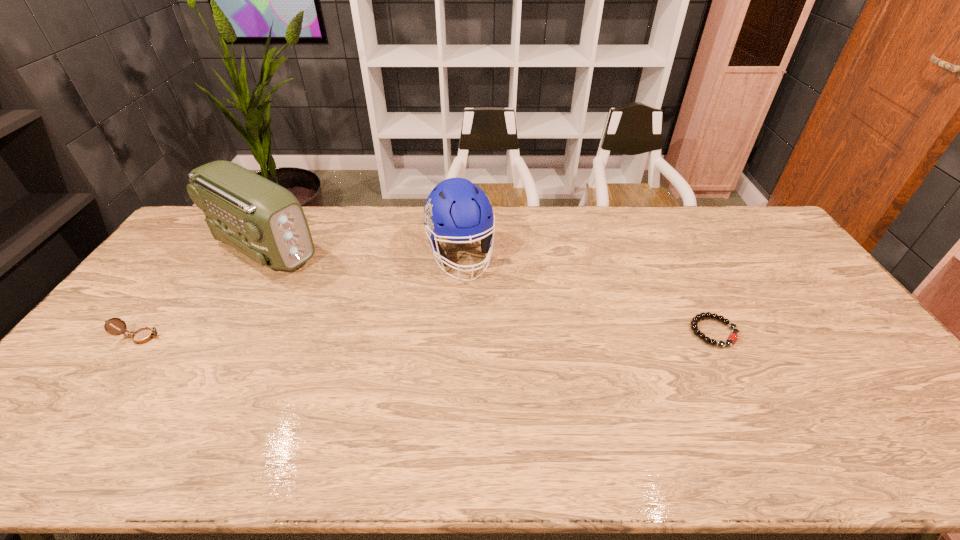
In the image, there is a desktop. Where is `vacant space at the right edge`? The width and height of the screenshot is (960, 540). vacant space at the right edge is located at coordinates (760, 264).

The width and height of the screenshot is (960, 540). Find the location of `free region at the far right corner of the desktop`. free region at the far right corner of the desktop is located at coordinates (779, 242).

At what (x,y) coordinates should I click in order to perform the action: click on free space at the near right corner of the desktop. Please return your answer as a coordinate pair (x, y). Looking at the image, I should click on (861, 399).

Locate an element on the screen. Image resolution: width=960 pixels, height=540 pixels. free space between the football helmet and the radio_receiver is located at coordinates coord(362,252).

What are the coordinates of `free space between the radio_receiver and the second object from right to left` in the screenshot? It's located at (362, 252).

Locate an element on the screen. The image size is (960, 540). free spot between the football helmet and the radio_receiver is located at coordinates (362, 252).

This screenshot has width=960, height=540. Identify the location of free space between the compass and the radio_receiver. (203, 292).

Image resolution: width=960 pixels, height=540 pixels. Identify the location of vacant space that is in between the third object from left to right and the shortest object. (587, 294).

You are a GUI agent. You are given a task and a screenshot of the screen. Output one action in this format:
    pyautogui.click(x=<x>, y=<y>)
    Task: Click on the free spot between the radio_receiver and the second shortest object
    The width and height of the screenshot is (960, 540).
    Given the screenshot: What is the action you would take?
    pyautogui.click(x=203, y=292)

Find the location of `free space between the radio_receiver and the rightmost object`. free space between the radio_receiver and the rightmost object is located at coordinates (489, 289).